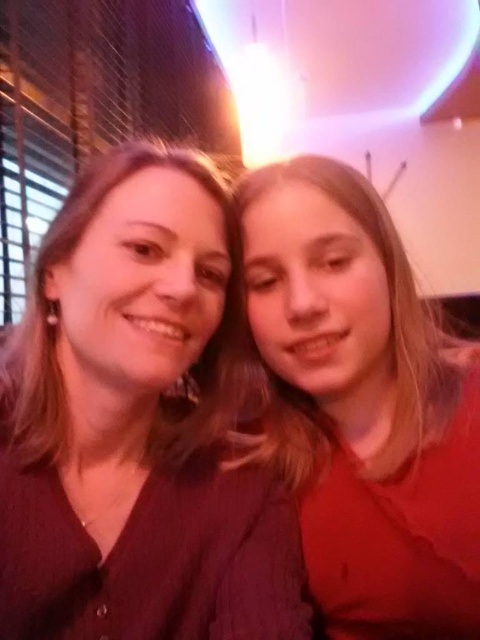
Question: Can you confirm if matte brown shirt at center is positioned below matte red shirt at right?

Choices:
 (A) yes
 (B) no

Answer: (A)

Question: Can you confirm if matte brown shirt at center is bigger than matte red shirt at right?

Choices:
 (A) yes
 (B) no

Answer: (A)

Question: Among these objects, which one is nearest to the camera?

Choices:
 (A) matte brown shirt at center
 (B) matte red shirt at right

Answer: (A)

Question: Which point is farther to the camera?

Choices:
 (A) matte red shirt at right
 (B) matte brown shirt at center

Answer: (A)

Question: Among these objects, which one is nearest to the camera?

Choices:
 (A) matte red shirt at right
 (B) matte brown shirt at center

Answer: (B)

Question: Is matte brown shirt at center positioned at the back of matte red shirt at right?

Choices:
 (A) no
 (B) yes

Answer: (A)